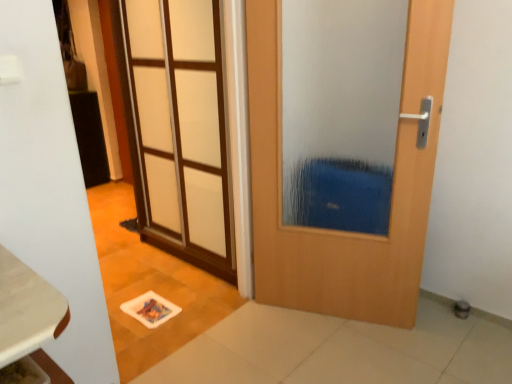
Question: Is the depth of wooden door at center, the second door viewed from the left, less than that of white frosted glass door at upper left, which is counted as the 2th door, starting from the right?

Choices:
 (A) yes
 (B) no

Answer: (A)

Question: Is wooden door at center, the second door viewed from the left, taller than white frosted glass door at upper left, which is counted as the first door, starting from the left?

Choices:
 (A) no
 (B) yes

Answer: (A)

Question: From the image's perspective, does wooden door at center, the second door viewed from the left, appear higher than white frosted glass door at upper left, which is counted as the 2th door, starting from the right?

Choices:
 (A) no
 (B) yes

Answer: (A)

Question: Would you consider wooden door at center, the second door viewed from the left, to be distant from white frosted glass door at upper left, which is counted as the first door, starting from the left?

Choices:
 (A) yes
 (B) no

Answer: (B)

Question: Is white frosted glass door at upper left, which is counted as the first door, starting from the left, at the back of wooden door at center, the second door viewed from the left?

Choices:
 (A) yes
 (B) no

Answer: (B)

Question: Is wooden door at center, which is counted as the first door, starting from the right, at the left side of white frosted glass door at upper left, which is counted as the 2th door, starting from the right?

Choices:
 (A) yes
 (B) no

Answer: (B)

Question: Is wooden table at lower left wider than wooden door at center, which is counted as the first door, starting from the right?

Choices:
 (A) no
 (B) yes

Answer: (B)

Question: Is wooden table at lower left positioned beyond the bounds of wooden door at center, which is counted as the first door, starting from the right?

Choices:
 (A) no
 (B) yes

Answer: (B)

Question: Would you say wooden table at lower left is a long distance from wooden door at center, which is counted as the first door, starting from the right?

Choices:
 (A) yes
 (B) no

Answer: (A)

Question: Is wooden table at lower left turned away from wooden door at center, which is counted as the first door, starting from the right?

Choices:
 (A) no
 (B) yes

Answer: (A)

Question: Is the position of wooden table at lower left more distant than that of wooden door at center, which is counted as the first door, starting from the right?

Choices:
 (A) no
 (B) yes

Answer: (A)

Question: From a real-world perspective, is wooden table at lower left physically below wooden door at center, which is counted as the first door, starting from the right?

Choices:
 (A) yes
 (B) no

Answer: (A)

Question: Considering the relative sizes of white frosted glass door at upper left, which is counted as the 2th door, starting from the right, and wooden door at center, which is counted as the first door, starting from the right, in the image provided, is white frosted glass door at upper left, which is counted as the 2th door, starting from the right, thinner than wooden door at center, which is counted as the first door, starting from the right,?

Choices:
 (A) yes
 (B) no

Answer: (A)